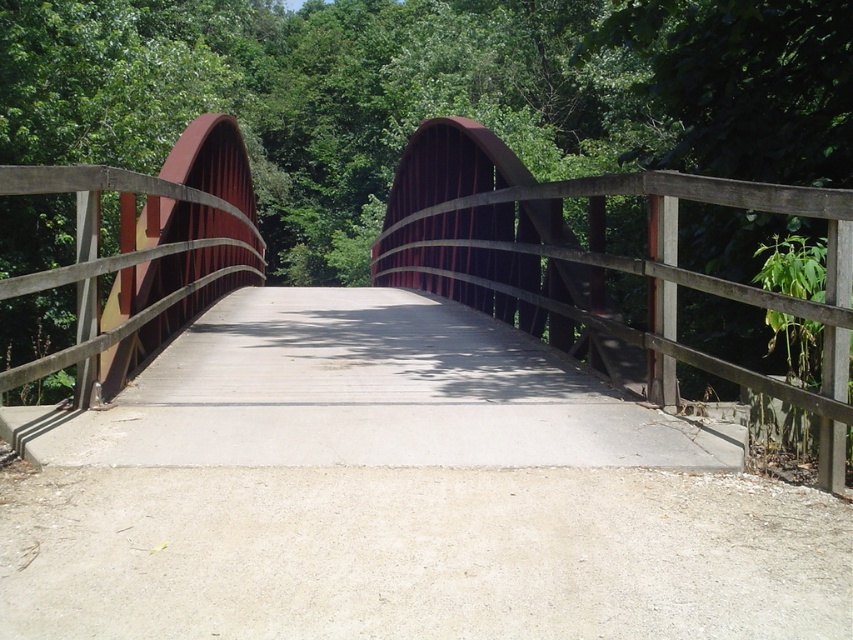
Question: Which object is closer to the camera taking this photo?

Choices:
 (A) metallic gray bridge at center
 (B) concrete at center

Answer: (A)

Question: Which of the following is the closest to the observer?

Choices:
 (A) concrete at center
 (B) metallic gray bridge at center

Answer: (B)

Question: Does metallic gray bridge at center come in front of concrete at center?

Choices:
 (A) yes
 (B) no

Answer: (A)

Question: Which of the following is the farthest from the observer?

Choices:
 (A) metallic gray bridge at center
 (B) concrete at center

Answer: (B)

Question: Is metallic gray bridge at center to the right of concrete at center from the viewer's perspective?

Choices:
 (A) yes
 (B) no

Answer: (A)

Question: Is metallic gray bridge at center to the right of concrete at center from the viewer's perspective?

Choices:
 (A) no
 (B) yes

Answer: (B)